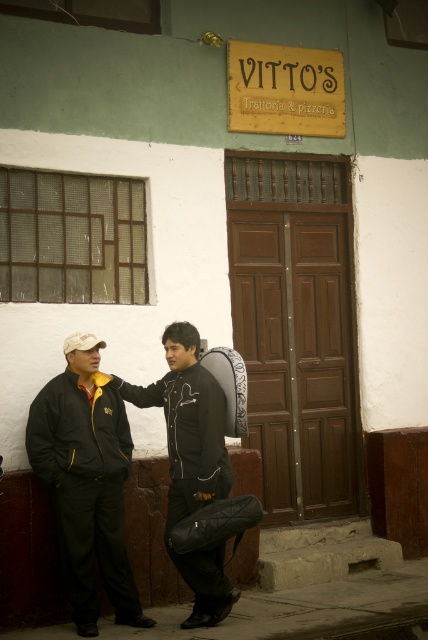
Question: Which point is farther from the camera taking this photo?

Choices:
 (A) click(219, 369)
 (B) click(175, 381)
 (C) click(56, 394)

Answer: (A)

Question: Which point is closer to the camera?

Choices:
 (A) matte black jacket at left
 (B) black leather jacket at center

Answer: (A)

Question: Is matte black jacket at left smaller than black leather backpack at center?

Choices:
 (A) no
 (B) yes

Answer: (A)

Question: Which is nearer to the black leather jacket at center?

Choices:
 (A) black leather backpack at center
 (B) matte black jacket at left

Answer: (A)

Question: Does black leather jacket at center have a lesser width compared to black leather backpack at center?

Choices:
 (A) yes
 (B) no

Answer: (B)

Question: Can you confirm if matte black jacket at left is thinner than black leather backpack at center?

Choices:
 (A) yes
 (B) no

Answer: (B)